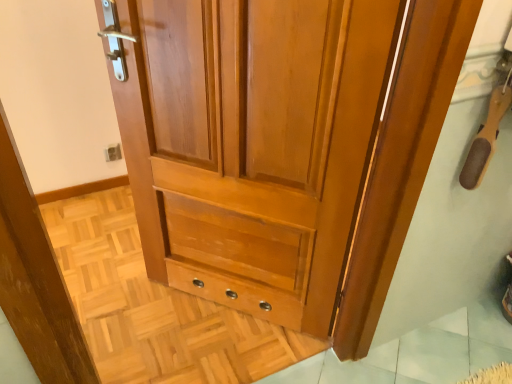
What do you see at coordinates (252, 143) in the screenshot? The height and width of the screenshot is (384, 512). I see `wooden door at center` at bounding box center [252, 143].

Measure the distance between wooden door at center and camera.

34.87 inches.

I want to click on wooden door at center, so click(x=252, y=143).

Identify the location of wooden door at center. pos(252,143).